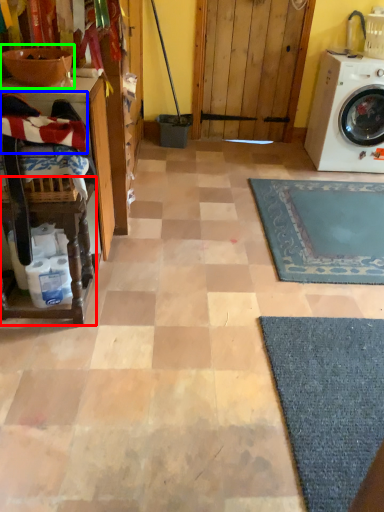
Question: Based on their relative distances, which object is nearer to table (highlighted by a red box)? Choose from laundry (highlighted by a blue box) and sink (highlighted by a green box).

Choices:
 (A) laundry
 (B) sink

Answer: (A)